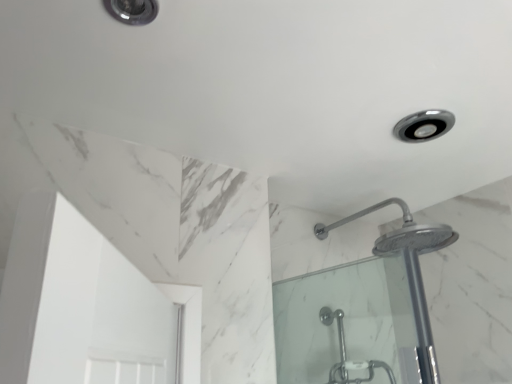
Question: Does satin nickel light fixture at upper right, arranged as the first light fixture when viewed from the back, have a larger size compared to matte silver light fixture at upper left, the second light fixture viewed from the back?

Choices:
 (A) no
 (B) yes

Answer: (B)

Question: Is satin nickel light fixture at upper right, the 2th light fixture in the left-to-right sequence, further to camera compared to matte silver light fixture at upper left, the second light fixture positioned from the bottom?

Choices:
 (A) yes
 (B) no

Answer: (A)

Question: Is satin nickel light fixture at upper right, which appears as the 1th light fixture when viewed from the right, wider than matte silver light fixture at upper left, which appears as the first light fixture when viewed from the top?

Choices:
 (A) yes
 (B) no

Answer: (A)

Question: Can you confirm if satin nickel light fixture at upper right, the 2th light fixture in the left-to-right sequence, is shorter than matte silver light fixture at upper left, the second light fixture from the right?

Choices:
 (A) no
 (B) yes

Answer: (A)

Question: Does satin nickel light fixture at upper right, the 2th light fixture when ordered from front to back, have a lesser width compared to matte silver light fixture at upper left, the first light fixture viewed from the front?

Choices:
 (A) yes
 (B) no

Answer: (B)

Question: Considering the relative positions of satin nickel light fixture at upper right, which is counted as the 2th light fixture, starting from the top, and matte silver light fixture at upper left, the first light fixture viewed from the front, in the image provided, is satin nickel light fixture at upper right, which is counted as the 2th light fixture, starting from the top, to the right of matte silver light fixture at upper left, the first light fixture viewed from the front, from the viewer's perspective?

Choices:
 (A) no
 (B) yes

Answer: (B)

Question: Is polished chrome shower head at upper right in front of matte silver light fixture at upper left, which appears as the first light fixture when viewed from the top?

Choices:
 (A) no
 (B) yes

Answer: (A)

Question: Is matte silver light fixture at upper left, the second light fixture positioned from the bottom, at the back of polished chrome shower head at upper right?

Choices:
 (A) no
 (B) yes

Answer: (A)

Question: Does polished chrome shower head at upper right have a smaller size compared to matte silver light fixture at upper left, the second light fixture viewed from the back?

Choices:
 (A) yes
 (B) no

Answer: (B)

Question: From a real-world perspective, is polished chrome shower head at upper right positioned over matte silver light fixture at upper left, the second light fixture positioned from the bottom, based on gravity?

Choices:
 (A) no
 (B) yes

Answer: (A)

Question: From a real-world perspective, does polished chrome shower head at upper right sit lower than matte silver light fixture at upper left, the second light fixture from the right?

Choices:
 (A) yes
 (B) no

Answer: (A)

Question: Is polished chrome shower head at upper right beside matte silver light fixture at upper left, the second light fixture viewed from the back?

Choices:
 (A) yes
 (B) no

Answer: (B)

Question: From a real-world perspective, does matte silver light fixture at upper left, placed as the 1th light fixture when sorted from left to right, stand above polished chrome shower head at upper right?

Choices:
 (A) no
 (B) yes

Answer: (B)